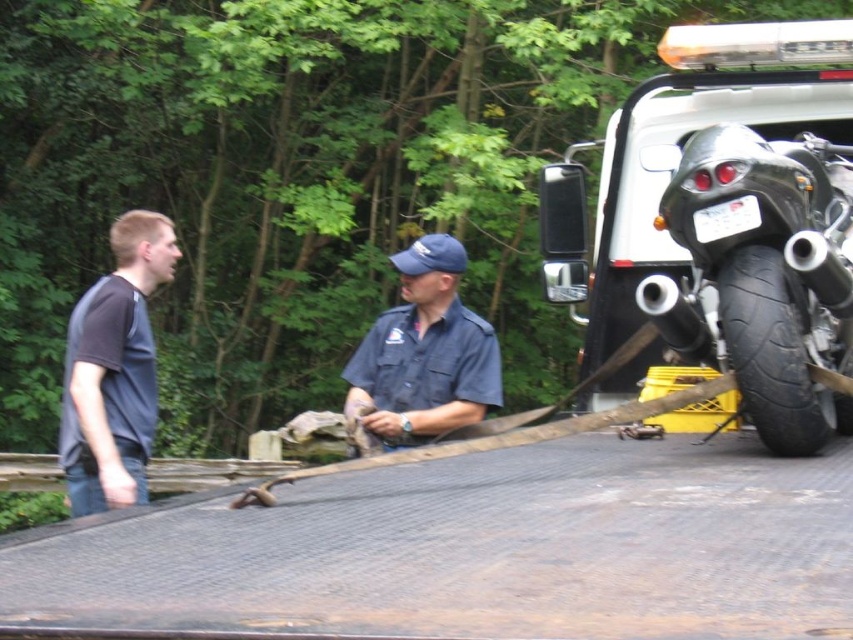
You are a photographer positioned in front of the scene. You want to take a photo of both the blue uniform shirt at center and the black rubber tire at right. Which object should you focus on first to ensure both are in sharp focus?

You should focus on the blue uniform shirt at center first because it is closer to you than the black rubber tire at right, ensuring both will be in focus when focused on the closer object.

You are standing at the point marked by point (764,276). Looking around, you see a shiny black motorcycle at right. Which direction should you face to see the motorcycle?

You should face to the right to see the shiny black motorcycle at right since the motorcycle is located at the right side of your position marked by point (764,276).